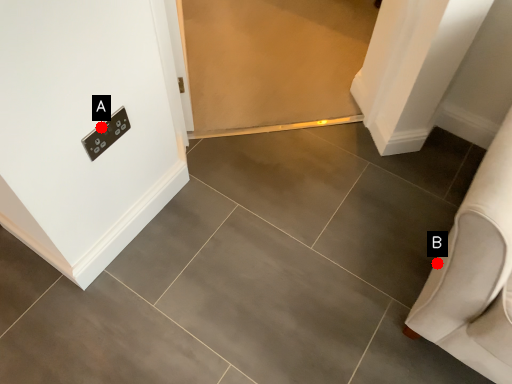
Question: Two points are circled on the image, labeled by A and B beside each circle. Among these points, which one is farthest from the camera?

Choices:
 (A) A is further
 (B) B is further

Answer: (B)